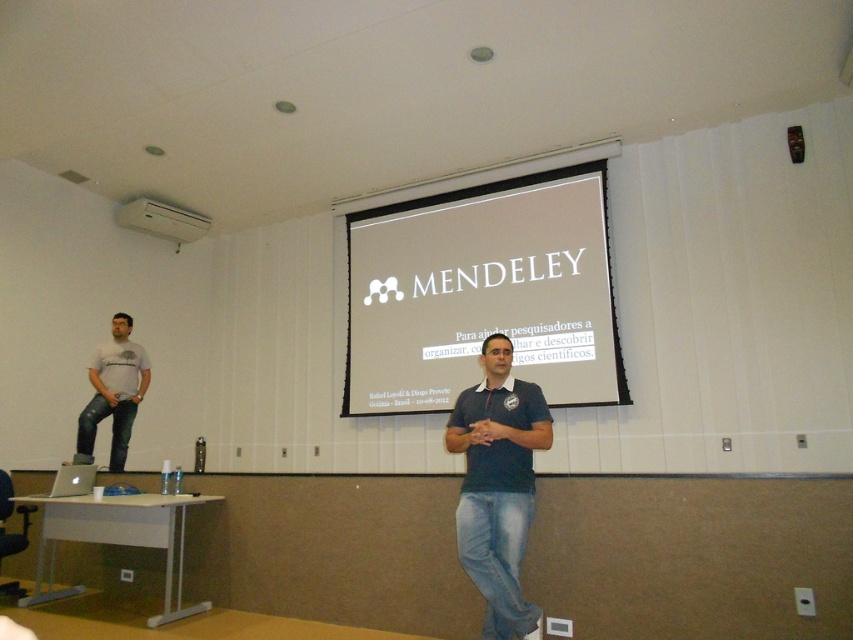
You are setting up a presentation in a room with a white matte projection screen at center and a white plastic projector at upper center. The projector is currently 2.41 meters away from the screen. If the recommended distance for optimal projection is 2.5 meters, is the projector placed correctly?

The white matte projection screen at center is 2.41 meters away from the white plastic projector at upper center. Since the recommended distance is 2.5 meters, the projector is placed slightly closer than optimal. To achieve the best projection quality, it should be moved back approximately 0.09 meters.

Where is the dark blue shirt at center located in the image?

The dark blue shirt at center is located at point (498, 484).

Based on the scene described, can you determine which object, the white matte projection screen at center or the white plastic projector at upper center, is wider?

The white matte projection screen at center is wider than the white plastic projector at upper center.